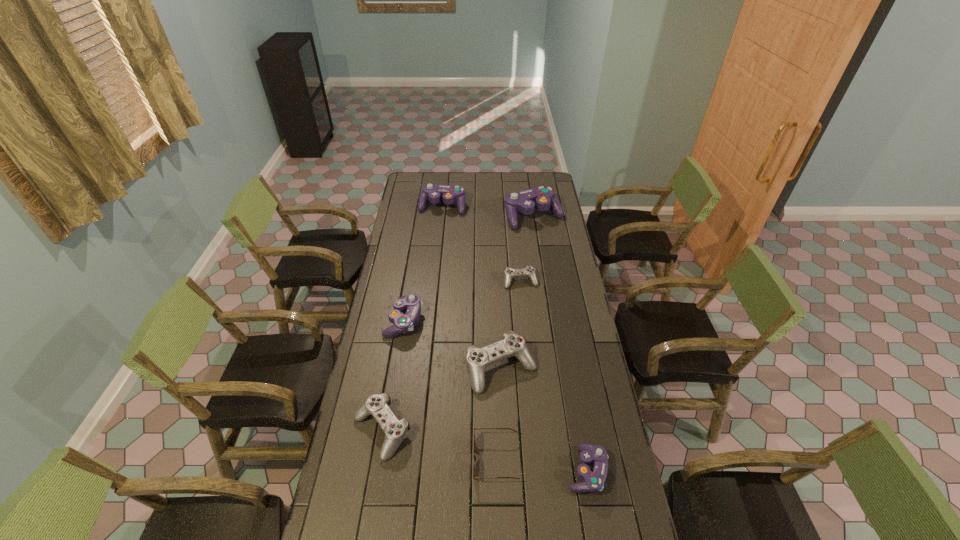
Where is `white control that stands as the second closest to the spectacles`? This screenshot has width=960, height=540. white control that stands as the second closest to the spectacles is located at coordinates (395, 430).

Identify the location of vacant region that satisfies the following two spatial constraints: 1. on the back side of the nearest white control; 2. on the left side of the biggest white control. Image resolution: width=960 pixels, height=540 pixels. (393, 369).